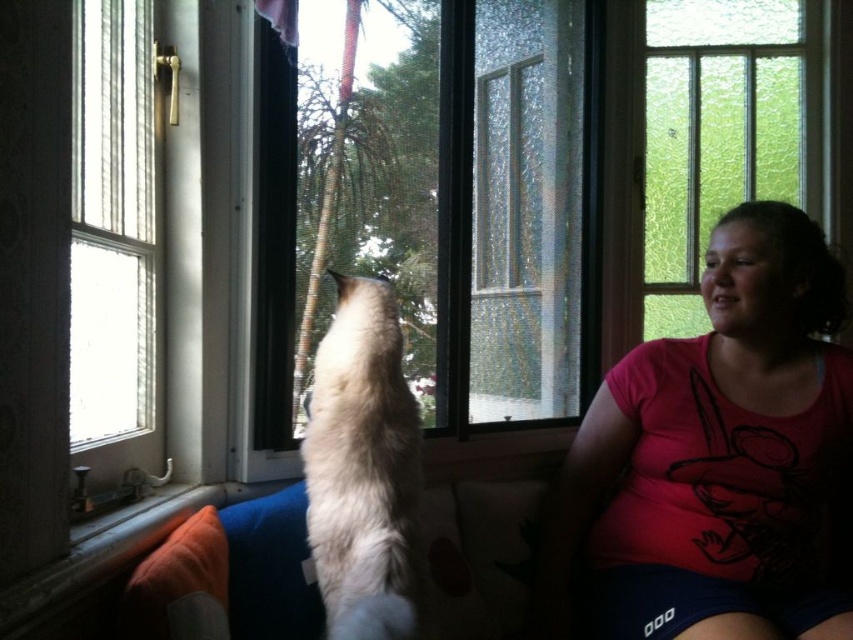
I want to click on transparent glass window at center, so click(431, 209).

At what (x,y) coordinates should I click in order to perform the action: click on transparent glass window at center. Please return your answer as a coordinate pair (x, y). The image size is (853, 640). Looking at the image, I should click on (431, 209).

Who is more distant from viewer, (82, 176) or (412, 432)?

The point (412, 432) is behind.

Which is above, clear glass window at left or white fluffy cat at center?

clear glass window at left is above.

Who is more forward, (x=96, y=104) or (x=326, y=516)?

Point (x=326, y=516)

I want to click on clear glass window at left, so click(112, 221).

Measure the distance between transparent glass window at center and clear glass window at left.

A distance of 21.79 inches exists between transparent glass window at center and clear glass window at left.

Can you confirm if transparent glass window at center is thinner than clear glass window at left?

Incorrect, transparent glass window at center's width is not less than clear glass window at left's.

What do you see at coordinates (431, 209) in the screenshot?
I see `transparent glass window at center` at bounding box center [431, 209].

Image resolution: width=853 pixels, height=640 pixels. In order to click on transparent glass window at center in this screenshot , I will do `click(431, 209)`.